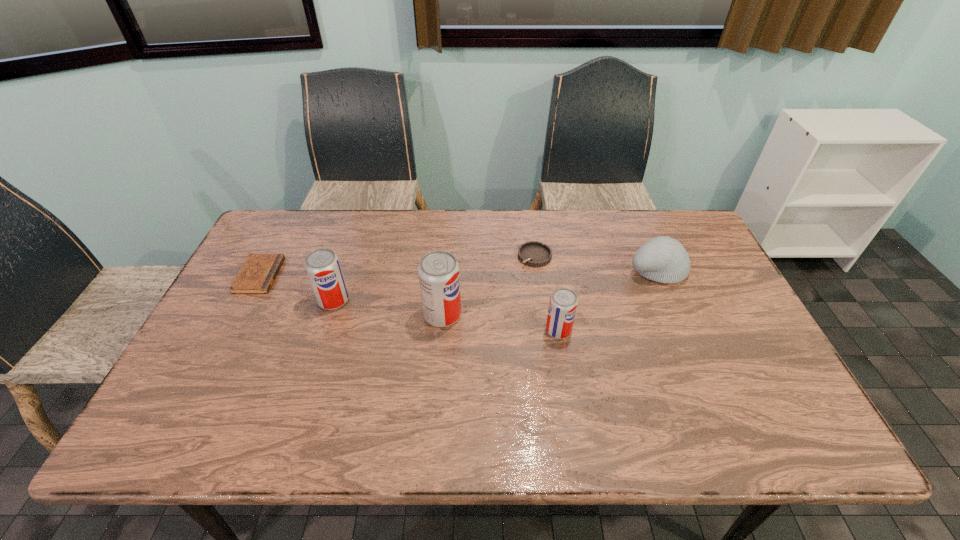
In the image, there is a desktop. Find the location of `vacant space at the far edge`. vacant space at the far edge is located at coordinates (375, 225).

The height and width of the screenshot is (540, 960). In order to click on free region at the near edge of the desktop in this screenshot , I will do `click(432, 392)`.

In the image, there is a desktop. Where is `free space at the left edge`? The height and width of the screenshot is (540, 960). free space at the left edge is located at coordinates (217, 336).

Find the location of a particular element. This screenshot has height=540, width=960. blank space at the right edge is located at coordinates (724, 309).

You are a GUI agent. You are given a task and a screenshot of the screen. Output one action in this format:
    pyautogui.click(x=<x>, y=<y>)
    Task: Click on the free region at the far left corner
    
    Given the screenshot: What is the action you would take?
    pyautogui.click(x=290, y=239)

Where is `free spot at the far right corner of the desktop`? The image size is (960, 540). free spot at the far right corner of the desktop is located at coordinates tap(692, 221).

At what (x,y) coordinates should I click in order to perform the action: click on vacant space at the near right corner. Please return your answer as a coordinate pair (x, y). Looking at the image, I should click on (738, 391).

Image resolution: width=960 pixels, height=540 pixels. In order to click on free space between the second object from left to right and the fourth object from right to left in this screenshot , I will do `click(388, 308)`.

This screenshot has width=960, height=540. Identify the location of free space between the diary and the ashtray. (397, 266).

Find the location of a particular element. The width and height of the screenshot is (960, 540). free space between the shortest object and the second shortest object is located at coordinates (397, 266).